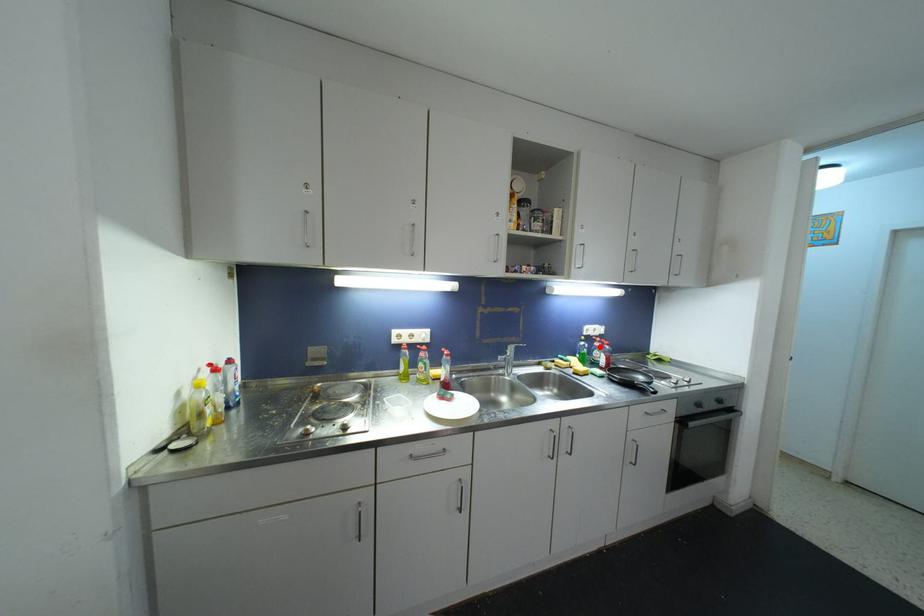
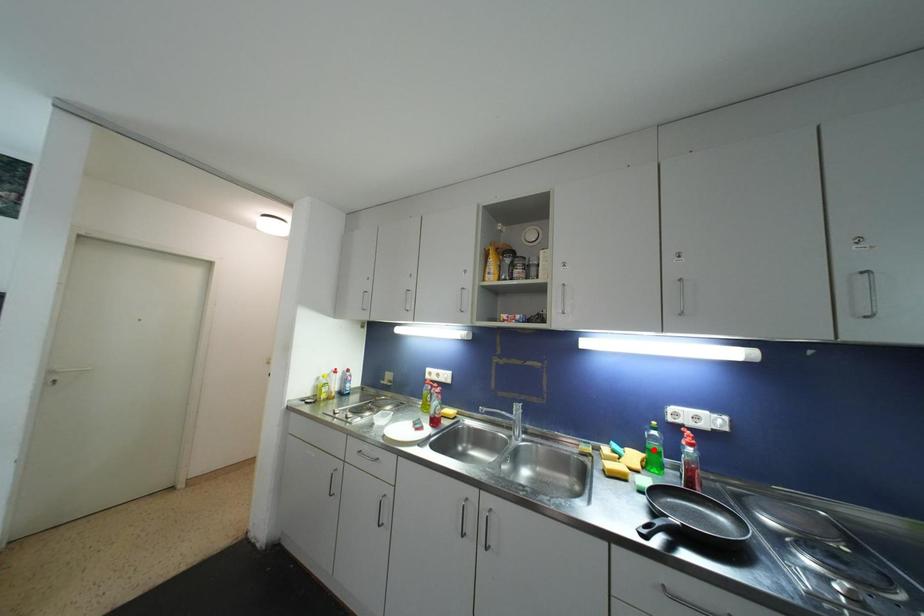
I am providing you with two images of the same scene from different viewpoints. A red point is marked on the first image and another point is marked on the second image. Does the point marked in image1 correspond to the same location as the one in image2?

No